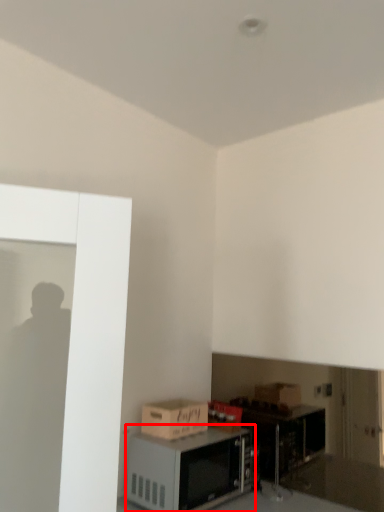
Question: Observing the image, what is the correct spatial positioning of microwave (annotated by the red box) in reference to cardboard box?

Choices:
 (A) right
 (B) left

Answer: (A)